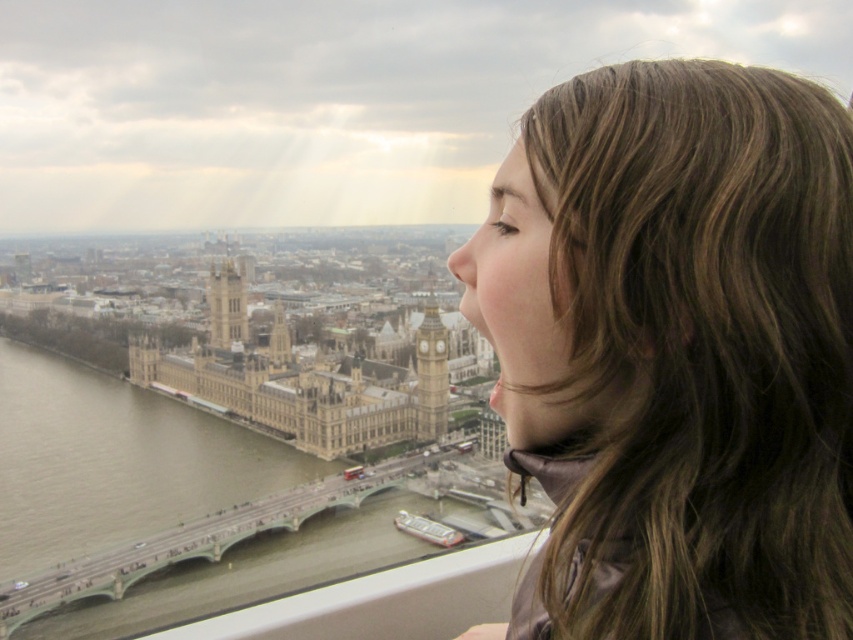
Which of these two, concrete bridge at lower left or golden stone clock tower at center, stands taller?

With more height is golden stone clock tower at center.

Is concrete bridge at lower left below golden stone clock tower at center?

Yes.

Between point (200, 531) and point (421, 362), which one is positioned in front?

Point (200, 531) is more forward.

What are the coordinates of `concrete bridge at lower left` in the screenshot? It's located at (178, 547).

Is point (602, 372) behind point (309, 381)?

No, (602, 372) is in front of (309, 381).

Is brown silky hair at upper right positioned before golden stone tower bridge at center?

Yes, brown silky hair at upper right is in front of golden stone tower bridge at center.

This screenshot has height=640, width=853. Find the location of `brown silky hair at upper right`. brown silky hair at upper right is located at coordinates click(675, 352).

Which is above, golden stone tower bridge at center or golden stone clock tower at center?

golden stone clock tower at center is higher up.

This screenshot has width=853, height=640. Describe the element at coordinates (300, 380) in the screenshot. I see `golden stone tower bridge at center` at that location.

Measure the distance between point (421, 344) and camera.

187.40 meters

Where is `golden stone tower bridge at center`? The image size is (853, 640). golden stone tower bridge at center is located at coordinates (300, 380).